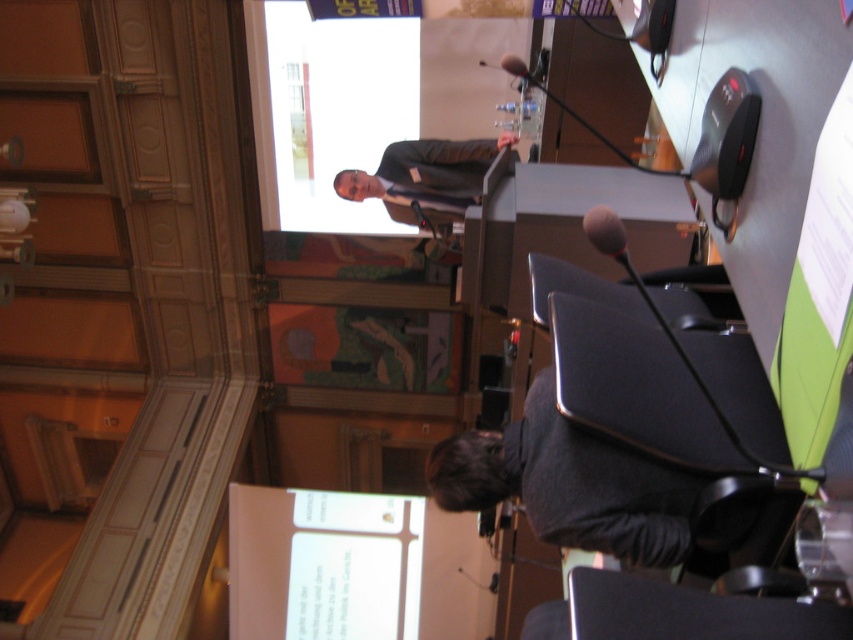
Does dark gray sweater at lower center have a greater width compared to matte black suit at upper center?

Incorrect, dark gray sweater at lower center's width does not surpass matte black suit at upper center's.

Which of these two, dark gray sweater at lower center or matte black suit at upper center, stands taller?

matte black suit at upper center

Is point (622, 460) positioned in front of point (433, 166)?

Yes, it is.

The width and height of the screenshot is (853, 640). In order to click on dark gray sweater at lower center in this screenshot , I will do `click(570, 483)`.